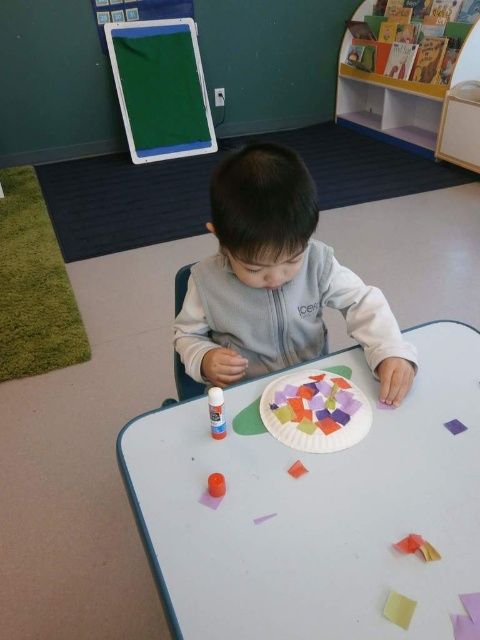
Between matte glue stick at center and orange matte paper at center, which one appears on the right side from the viewer's perspective?

orange matte paper at center

What do you see at coordinates (216, 412) in the screenshot? I see `matte glue stick at center` at bounding box center [216, 412].

Locate an element on the screen. This screenshot has width=480, height=640. matte glue stick at center is located at coordinates (216, 412).

Is point (407, 536) closer to camera compared to point (304, 467)?

Yes, point (407, 536) is in front of point (304, 467).

Identify the location of gold metallic toy at lower right. The height and width of the screenshot is (640, 480). (417, 547).

Based on the photo, is gray fleece toddler at center to the left of yellow matte paper at lower right from the viewer's perspective?

Indeed, gray fleece toddler at center is positioned on the left side of yellow matte paper at lower right.

The width and height of the screenshot is (480, 640). I want to click on gray fleece toddler at center, so (x=276, y=282).

Locate an element on the screen. The image size is (480, 640). gray fleece toddler at center is located at coordinates (276, 282).